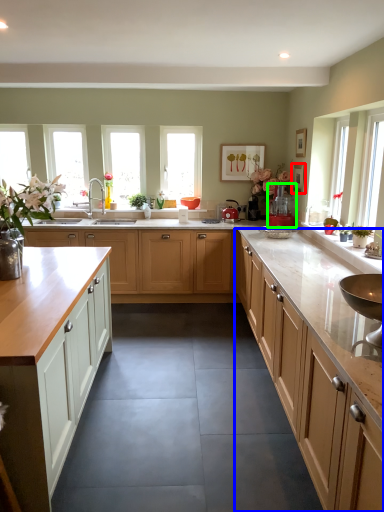
Question: Estimate the real-world distances between objects in this image. Which object is farther from picture frame (highlighted by a red box), cabinetry (highlighted by a blue box) or appliance (highlighted by a green box)?

Choices:
 (A) cabinetry
 (B) appliance

Answer: (A)